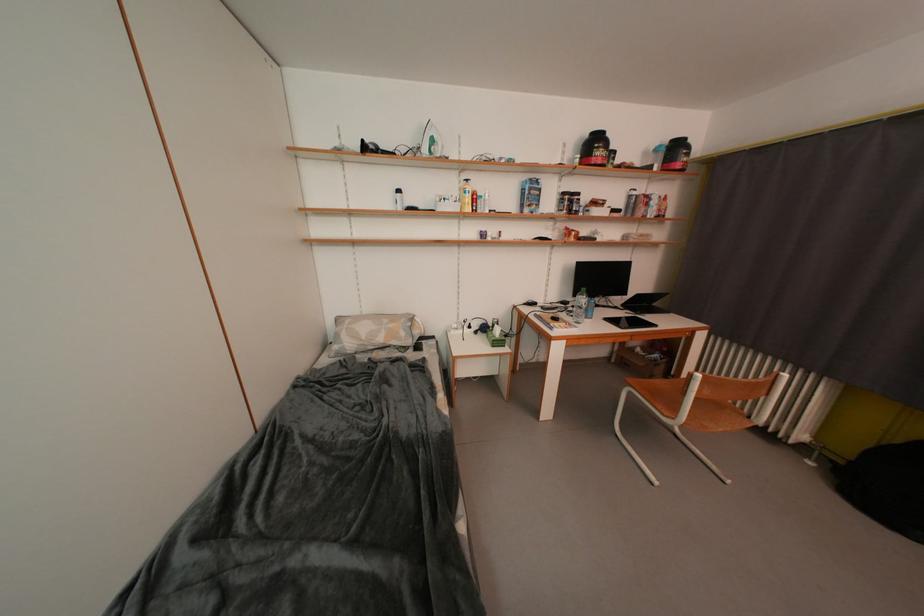
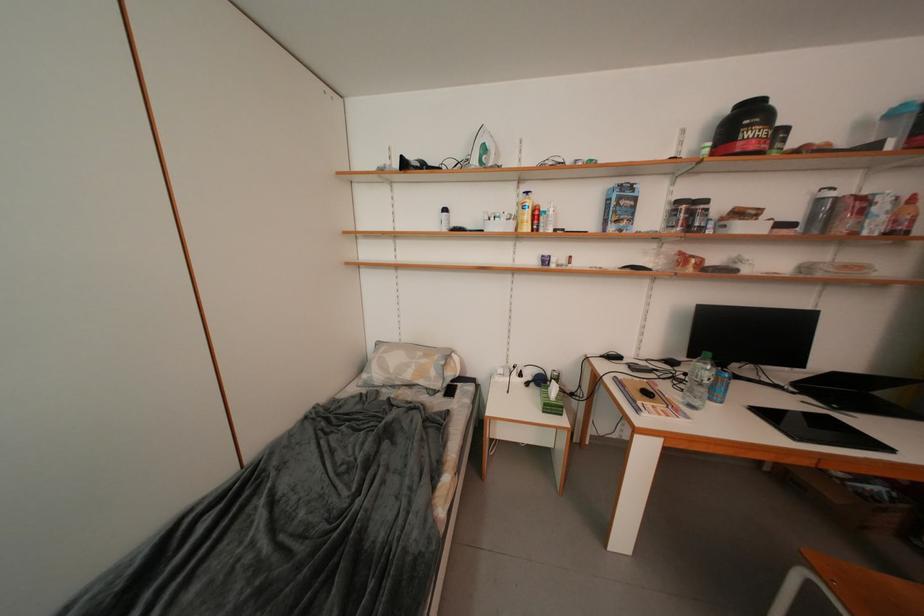
Which direction would the cameraman need to move to produce the second image?

The cameraman walked toward right, forward.